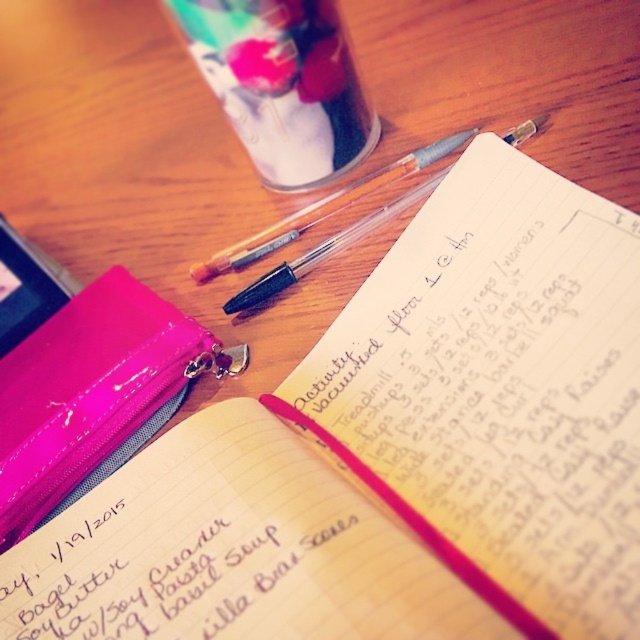
Question: Does matte paper notebook at center have a smaller size compared to pink glossy binder at lower left?

Choices:
 (A) yes
 (B) no

Answer: (A)

Question: Is matte paper notebook at center positioned before pink glossy binder at lower left?

Choices:
 (A) yes
 (B) no

Answer: (A)

Question: Is matte paper notebook at center to the right of pink glossy binder at lower left from the viewer's perspective?

Choices:
 (A) no
 (B) yes

Answer: (B)

Question: Which point appears closest to the camera in this image?

Choices:
 (A) (97, 412)
 (B) (240, 632)

Answer: (B)

Question: Which point appears farthest from the camera in this image?

Choices:
 (A) (22, 358)
 (B) (52, 609)

Answer: (A)